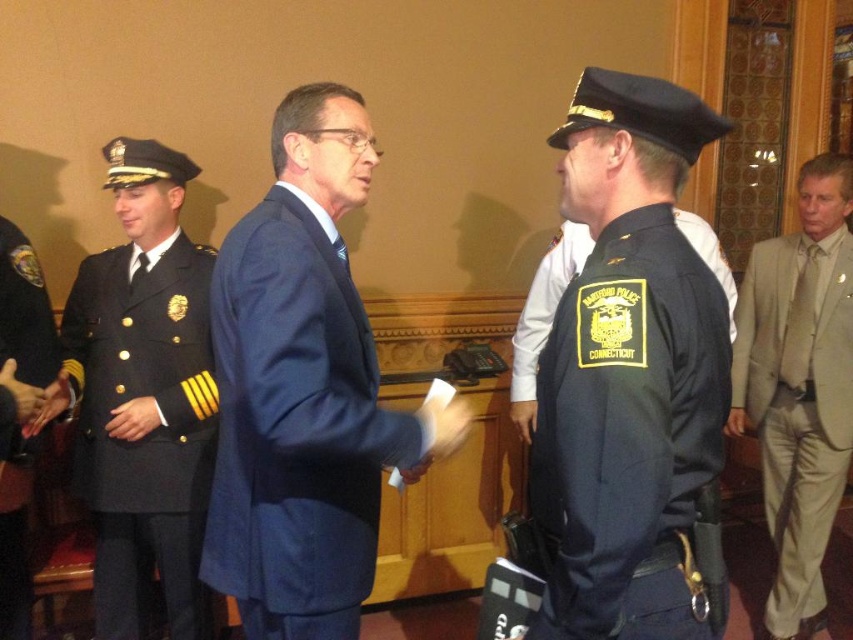
Between navy blue fabric uniform at center and light beige fabric suit at right, which one appears on the left side from the viewer's perspective?

navy blue fabric uniform at center

Does point (618, 451) lie behind point (809, 397)?

No.

Find the location of a particular element. The width and height of the screenshot is (853, 640). navy blue fabric uniform at center is located at coordinates (628, 429).

Is navy blue suit at center to the left of light beige fabric suit at right from the viewer's perspective?

Correct, you'll find navy blue suit at center to the left of light beige fabric suit at right.

Can you confirm if navy blue suit at center is thinner than light beige fabric suit at right?

Incorrect, navy blue suit at center's width is not less than light beige fabric suit at right's.

Identify the location of navy blue suit at center. The height and width of the screenshot is (640, 853). (294, 422).

Who is positioned more to the right, navy blue fabric uniform at center or dark blue fabric uniform at left?

From the viewer's perspective, navy blue fabric uniform at center appears more on the right side.

Is navy blue fabric uniform at center to the left of dark blue fabric uniform at left from the viewer's perspective?

In fact, navy blue fabric uniform at center is to the right of dark blue fabric uniform at left.

Is point (671, 236) farther from viewer compared to point (132, 394)?

No, (671, 236) is in front of (132, 394).

At what (x,y) coordinates should I click in order to perform the action: click on navy blue fabric uniform at center. Please return your answer as a coordinate pair (x, y). Looking at the image, I should click on (628, 429).